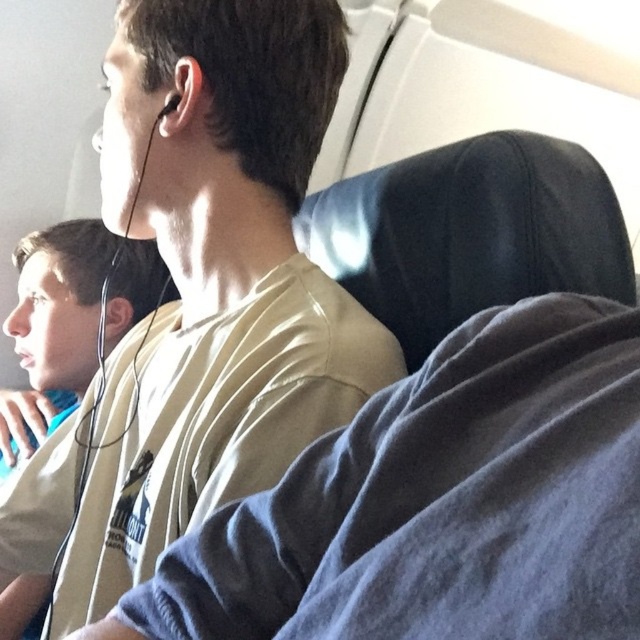
Question: Which object appears closest to the camera in this image?

Choices:
 (A) black leather seat at center
 (B) light beige t-shirt at center
 (C) light beige t-shirt at left
 (D) black matte earphone at upper left

Answer: (B)

Question: Is black leather seat at center smaller than black matte earphone at upper left?

Choices:
 (A) no
 (B) yes

Answer: (A)

Question: Does black leather seat at center have a larger size compared to light beige t-shirt at left?

Choices:
 (A) no
 (B) yes

Answer: (A)

Question: Is light beige t-shirt at center thinner than black leather seat at center?

Choices:
 (A) yes
 (B) no

Answer: (B)

Question: Which point is closer to the camera?

Choices:
 (A) black leather seat at center
 (B) black matte earphone at upper left
 (C) light beige t-shirt at center

Answer: (C)

Question: Which point is farther from the camera taking this photo?

Choices:
 (A) (224, 99)
 (B) (164, 106)
 (C) (404, 227)

Answer: (B)